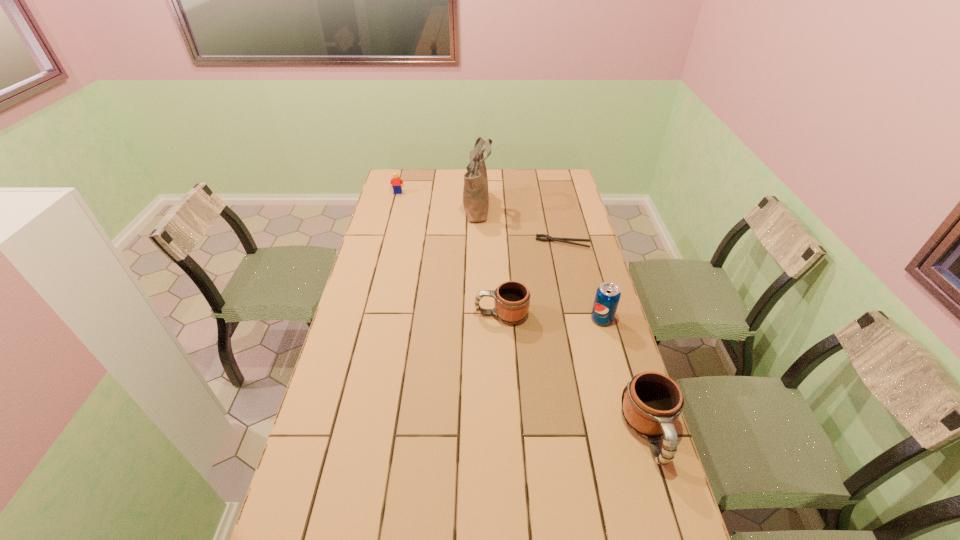
Find the location of a particular element. This screenshot has width=960, height=540. the left mug is located at coordinates (511, 299).

Locate an element on the screen. the shorter mug is located at coordinates (511, 299).

This screenshot has width=960, height=540. What are the coordinates of `the nearer mug` in the screenshot? It's located at (652, 403).

The image size is (960, 540). I want to click on the nearest object, so click(x=652, y=403).

Locate an element on the screen. shoulder bag is located at coordinates (475, 192).

This screenshot has width=960, height=540. Identify the location of Lego. (396, 181).

You are a GUI agent. You are given a task and a screenshot of the screen. Output one action in this format:
    pyautogui.click(x=<x>, y=<y>)
    Task: Click on the shortest object
    This screenshot has height=540, width=960.
    Given the screenshot: What is the action you would take?
    pyautogui.click(x=548, y=238)

Locate an element on the screen. The width and height of the screenshot is (960, 540). tongs is located at coordinates (548, 238).

At what (x,y) coordinates should I click in order to perform the action: click on pop soda. Please return your answer as a coordinate pair (x, y). The image size is (960, 540). Looking at the image, I should click on (608, 294).

Locate an element on the screen. The width and height of the screenshot is (960, 540). free point located 0.350m on the side of the farther mug with the handle is located at coordinates (374, 314).